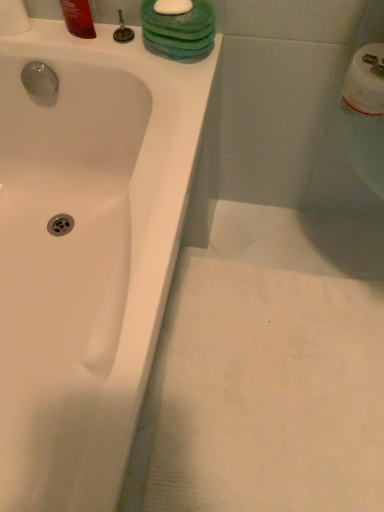
Question: Can you confirm if white glossy bathtub at upper left is smaller than shiny plastic bottle at upper left?

Choices:
 (A) yes
 (B) no

Answer: (B)

Question: Is white glossy bathtub at upper left positioned far away from shiny plastic bottle at upper left?

Choices:
 (A) no
 (B) yes

Answer: (A)

Question: Is shiny plastic bottle at upper left surrounded by white glossy bathtub at upper left?

Choices:
 (A) no
 (B) yes

Answer: (A)

Question: Is white glossy bathtub at upper left taller than shiny plastic bottle at upper left?

Choices:
 (A) yes
 (B) no

Answer: (A)

Question: Can you confirm if white glossy bathtub at upper left is thinner than shiny plastic bottle at upper left?

Choices:
 (A) no
 (B) yes

Answer: (A)

Question: Is point (114, 37) closer or farther from the camera than point (4, 22)?

Choices:
 (A) closer
 (B) farther

Answer: (A)

Question: Is matte silver faucet at upper center wider or thinner than white paper towel at upper left?

Choices:
 (A) thin
 (B) wide

Answer: (A)

Question: From a real-world perspective, relative to white paper towel at upper left, is matte silver faucet at upper center vertically above or below?

Choices:
 (A) below
 (B) above

Answer: (A)

Question: Looking at the image, does matte silver faucet at upper center seem bigger or smaller compared to white paper towel at upper left?

Choices:
 (A) small
 (B) big

Answer: (A)

Question: In terms of width, does shiny plastic bottle at upper left look wider or thinner when compared to matte silver faucet at upper center?

Choices:
 (A) thin
 (B) wide

Answer: (B)

Question: In the image, is shiny plastic bottle at upper left positioned in front of or behind matte silver faucet at upper center?

Choices:
 (A) behind
 (B) front

Answer: (B)

Question: Is shiny plastic bottle at upper left spatially inside matte silver faucet at upper center, or outside of it?

Choices:
 (A) inside
 (B) outside

Answer: (B)

Question: In terms of height, does shiny plastic bottle at upper left look taller or shorter compared to matte silver faucet at upper center?

Choices:
 (A) short
 (B) tall

Answer: (B)

Question: In terms of height, does matte silver faucet at upper center look taller or shorter compared to shiny plastic bottle at upper left?

Choices:
 (A) short
 (B) tall

Answer: (A)

Question: Looking at their shapes, would you say matte silver faucet at upper center is wider or thinner than shiny plastic bottle at upper left?

Choices:
 (A) wide
 (B) thin

Answer: (B)